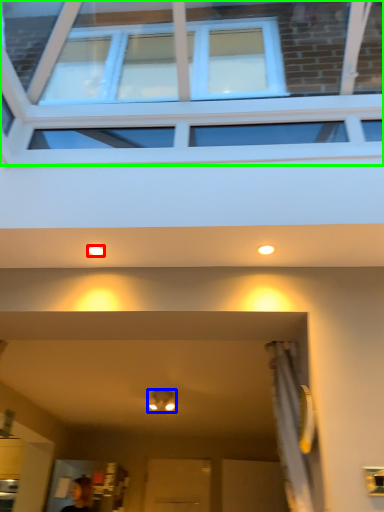
Question: Which is farther away from lighting (highlighted by a red box)? light fixture (highlighted by a blue box) or window (highlighted by a green box)?

Choices:
 (A) light fixture
 (B) window

Answer: (A)